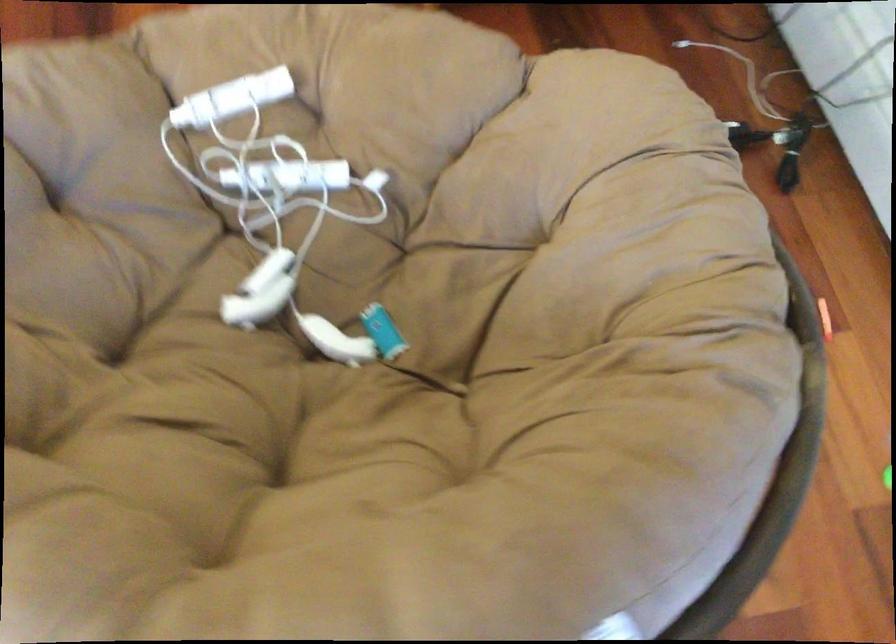
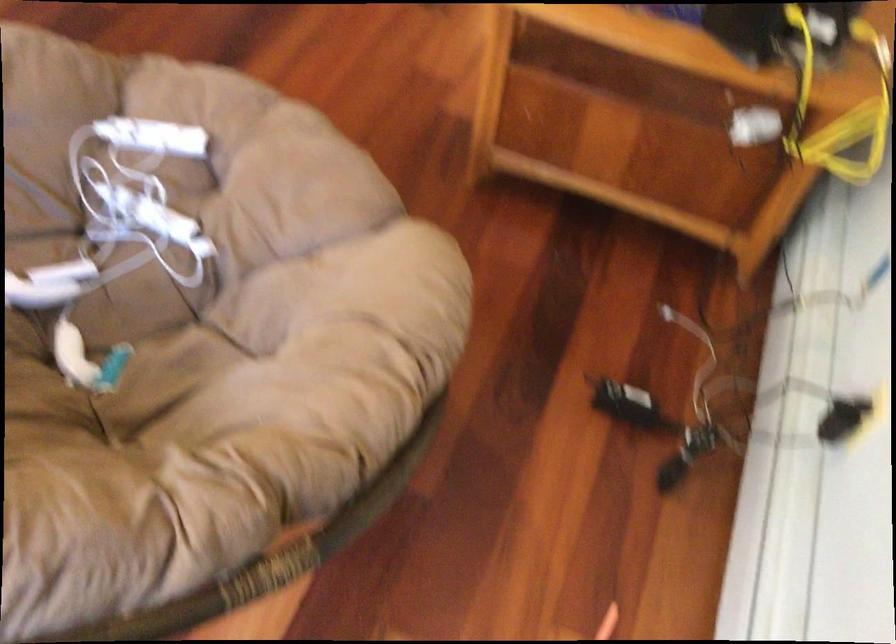
The point at (268,211) is marked in the first image. Where is the corresponding point in the second image?

(113, 236)